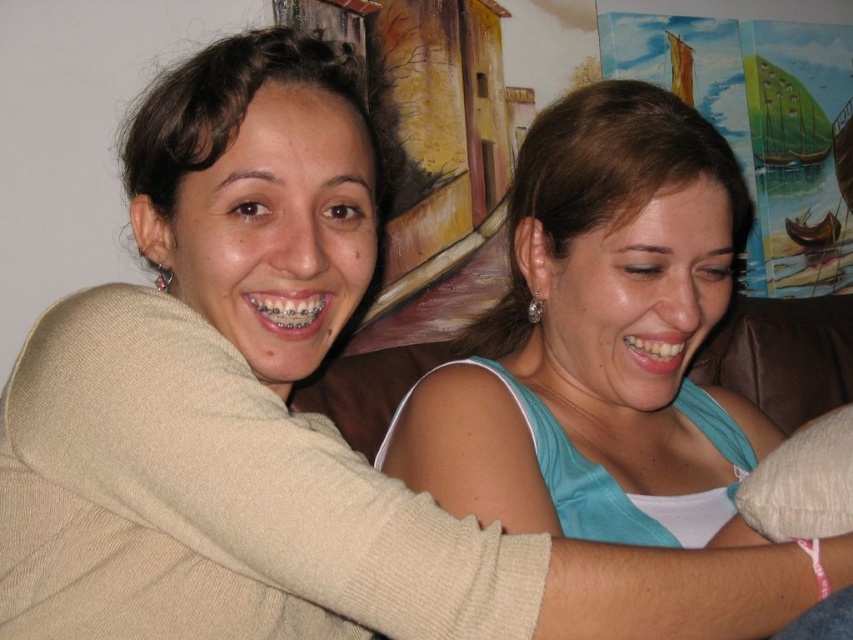
Question: Is metallic braces at center below white glossy teeth at center?

Choices:
 (A) no
 (B) yes

Answer: (A)

Question: Which of the following is the farthest from the observer?

Choices:
 (A) white glossy teeth at center
 (B) beige fabric pillow at lower right
 (C) metallic braces at center

Answer: (A)

Question: Which of these objects is positioned closest to the beige fabric pillow at lower right?

Choices:
 (A) metallic braces at center
 (B) white glossy teeth at center

Answer: (B)

Question: Does beige fabric pillow at lower right appear over white glossy teeth at center?

Choices:
 (A) no
 (B) yes

Answer: (A)

Question: Which point is closer to the camera?

Choices:
 (A) (682, 353)
 (B) (844, 531)

Answer: (B)

Question: Is beige fabric pillow at lower right bigger than white glossy teeth at center?

Choices:
 (A) yes
 (B) no

Answer: (A)